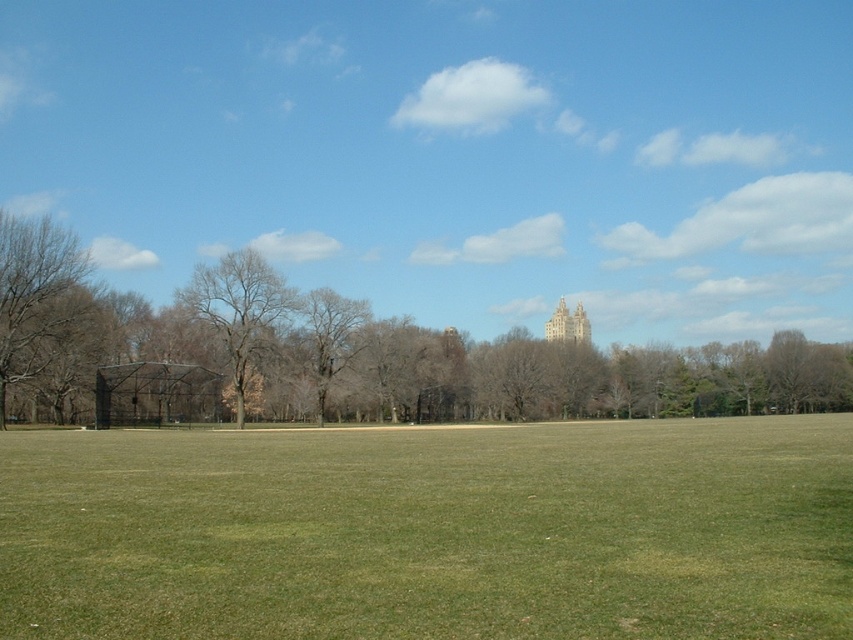
You are a photographer wanting to capture both the brown leafless tree at left and the light brown stone tower at center in your shot. Based on their positions, which object would appear larger in the photo?

The brown leafless tree at left appears larger in the photo because it is closer to the viewer than the light brown stone tower at center.

You are a photographer standing at the edge of the grassy field. You want to take a photo of the brown leafless tree at left while ensuring it doesn not appear too small in the frame. Given that your camera has a maximum zoom range of 100 meters, can you capture the tree without moving closer?

The brown leafless tree at left is 55.56 meters away from the camera. Since the camera can zoom up to 100 meters, it is possible to capture the tree without moving closer as the distance is within the zoom range.